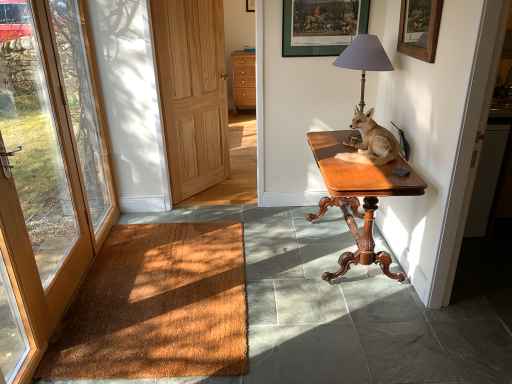
Locate an element on the screen. The width and height of the screenshot is (512, 384). brown coir mat at lower left is located at coordinates click(156, 307).

This screenshot has width=512, height=384. What do you see at coordinates (358, 196) in the screenshot?
I see `mahogany wood desk at right` at bounding box center [358, 196].

I want to click on light brown wood door at center, the 2th door when ordered from left to right, so click(192, 92).

This screenshot has width=512, height=384. What do you see at coordinates (419, 28) in the screenshot? I see `wooden framed picture at upper right, the 1th picture frame positioned from the front` at bounding box center [419, 28].

Where is `brown coir mat at lower left`? The height and width of the screenshot is (384, 512). brown coir mat at lower left is located at coordinates (156, 307).

Is wooden framed picture at upper right, which is the second picture frame in back-to-front order, directly adjacent to light brown wood drawers at center?

No, wooden framed picture at upper right, which is the second picture frame in back-to-front order, is not making contact with light brown wood drawers at center.

Which is in front, point (410, 42) or point (238, 92)?

Point (410, 42)

From the picture: Could you measure the distance between wooden framed picture at upper right, which is the second picture frame in back-to-front order, and light brown wood drawers at center?

They are 4.70 meters apart.

Considering the sizes of objects wooden framed picture at upper right, the second picture frame from the left, and light brown wood drawers at center in the image provided, who is taller, wooden framed picture at upper right, the second picture frame from the left, or light brown wood drawers at center?

Standing taller between the two is light brown wood drawers at center.

Do you think metallic gray lampshade at upper right is within green matte picture frame at upper center, the 1th picture frame in the back-to-front sequence, or outside of it?

metallic gray lampshade at upper right cannot be found inside green matte picture frame at upper center, the 1th picture frame in the back-to-front sequence.

From the image's perspective, is metallic gray lampshade at upper right located above green matte picture frame at upper center, placed as the second picture frame when sorted from front to back?

No.

Which of these two, metallic gray lampshade at upper right or green matte picture frame at upper center, the first picture frame when ordered from left to right, stands taller?

Standing taller between the two is metallic gray lampshade at upper right.

How many degrees apart are the facing directions of metallic gray lampshade at upper right and green matte picture frame at upper center, placed as the second picture frame when sorted from front to back?

The angle between the facing direction of metallic gray lampshade at upper right and the facing direction of green matte picture frame at upper center, placed as the second picture frame when sorted from front to back, is 90.7 degrees.

Is light brown fur at table right beside light brown wood door at center, which is the first door in right-to-left order?

No, light brown fur at table right is not with light brown wood door at center, which is the first door in right-to-left order.

Is light brown fur at table right taller or shorter than light brown wood door at center, which is the first door in right-to-left order?

Clearly, light brown fur at table right is shorter compared to light brown wood door at center, which is the first door in right-to-left order.

Is light brown fur at table right oriented towards light brown wood door at center, the 2th door when ordered from left to right?

No, light brown fur at table right is not oriented towards light brown wood door at center, the 2th door when ordered from left to right.

Considering the positions of points (369, 158) and (210, 128), is point (369, 158) farther from camera compared to point (210, 128)?

No, it is in front of (210, 128).

Is light brown wood door at center, which is the first door in right-to-left order, facing towards wooden framed picture at upper right, which is the second picture frame in back-to-front order?

Yes, light brown wood door at center, which is the first door in right-to-left order, is facing wooden framed picture at upper right, which is the second picture frame in back-to-front order.

Which of these two, light brown wood door at center, which is the first door in right-to-left order, or wooden framed picture at upper right, the second picture frame from the left, is wider?

With larger width is light brown wood door at center, which is the first door in right-to-left order.

Can you confirm if light brown wood door at center, which is the first door in right-to-left order, is taller than wooden framed picture at upper right, which is counted as the 1th picture frame, starting from the right?

Correct, light brown wood door at center, which is the first door in right-to-left order, is much taller as wooden framed picture at upper right, which is counted as the 1th picture frame, starting from the right.

Would you say light brown wood door at center, the 2th door when ordered from left to right, is a long distance from wooden framed picture at upper right, which is counted as the 1th picture frame, starting from the right?

Yes, light brown wood door at center, the 2th door when ordered from left to right, and wooden framed picture at upper right, which is counted as the 1th picture frame, starting from the right, are quite far apart.

From a real-world perspective, is brown wood door at left, which appears as the 2th door when viewed from the right, on light brown fur at table right?

No.

Does brown wood door at left, which appears as the 2th door when viewed from the right, have a lesser height compared to light brown fur at table right?

No, brown wood door at left, which appears as the 2th door when viewed from the right, is not shorter than light brown fur at table right.

From the image's perspective, relative to light brown fur at table right, is brown wood door at left, which appears as the 2th door when viewed from the right, above or below?

brown wood door at left, which appears as the 2th door when viewed from the right, is situated lower than light brown fur at table right in the image.

You are a GUI agent. You are given a task and a screenshot of the screen. Output one action in this format:
    pyautogui.click(x=<x>, y=<y>)
    Task: Click on the desk in front of the metallic gray lampshade at upper right
    The width and height of the screenshot is (512, 384).
    Given the screenshot: What is the action you would take?
    pyautogui.click(x=358, y=196)

From the picture: Which is more to the right, metallic gray lampshade at upper right or mahogany wood desk at right?

metallic gray lampshade at upper right.

Based on the photo, is metallic gray lampshade at upper right taller than mahogany wood desk at right?

No.

Are green matte picture frame at upper center, the first picture frame when ordered from left to right, and mahogany wood desk at right far apart?

They are positioned close to each other.

Could you tell me if green matte picture frame at upper center, placed as the second picture frame when sorted from front to back, is facing mahogany wood desk at right?

No, green matte picture frame at upper center, placed as the second picture frame when sorted from front to back, is not aimed at mahogany wood desk at right.

From a real-world perspective, between green matte picture frame at upper center, the 1th picture frame in the back-to-front sequence, and mahogany wood desk at right, who is vertically higher?

green matte picture frame at upper center, the 1th picture frame in the back-to-front sequence, is physically above.

Find the location of a particular element. This screenshot has width=512, height=384. the 2nd picture frame below when counting from the light brown wood drawers at center (from the image's perspective) is located at coordinates (419, 28).

The width and height of the screenshot is (512, 384). I want to click on lamp located in front of the green matte picture frame at upper center, marked as the 2th picture frame in a right-to-left arrangement, so click(364, 59).

Based on their spatial positions, is metallic gray lampshade at upper right or green matte picture frame at upper center, the 1th picture frame in the back-to-front sequence, closer to brown coir mat at lower left?

metallic gray lampshade at upper right.

Based on their spatial positions, is mahogany wood desk at right or light brown fur at table right further from brown coir mat at lower left?

light brown fur at table right is positioned further to the anchor brown coir mat at lower left.

Looking at the image, which one is located further to light brown wood drawers at center, wooden framed picture at upper right, the second picture frame from the left, or light brown wood door at center, the 2th door when ordered from left to right?

wooden framed picture at upper right, the second picture frame from the left.

Based on their spatial positions, is mahogany wood desk at right or light brown wood door at center, which is the first door in right-to-left order, further from green matte picture frame at upper center, the first picture frame when ordered from left to right?

Among the two, light brown wood door at center, which is the first door in right-to-left order, is located further to green matte picture frame at upper center, the first picture frame when ordered from left to right.

Considering their positions, is light brown wood drawers at center positioned closer to wooden framed picture at upper right, the second picture frame from the left, than light brown wood door at center, the 2th door when ordered from left to right?

light brown wood door at center, the 2th door when ordered from left to right, is positioned closer to the anchor wooden framed picture at upper right, the second picture frame from the left.

Considering their positions, is brown coir mat at lower left positioned closer to light brown wood drawers at center than metallic gray lampshade at upper right?

Based on the image, metallic gray lampshade at upper right appears to be nearer to light brown wood drawers at center.

From the image, which object appears to be nearer to metallic gray lampshade at upper right, light brown fur at table right or light brown wood door at center, the 2th door when ordered from left to right?

Among the two, light brown fur at table right is located nearer to metallic gray lampshade at upper right.

Which object lies nearer to the anchor point brown coir mat at lower left, green matte picture frame at upper center, placed as the second picture frame when sorted from front to back, or metallic gray lampshade at upper right?

metallic gray lampshade at upper right is positioned closer to the anchor brown coir mat at lower left.

At what (x,y) coordinates should I click in order to perform the action: click on desk between green matte picture frame at upper center, marked as the 2th picture frame in a right-to-left arrangement, and brown coir mat at lower left, in the vertical direction. Please return your answer as a coordinate pair (x, y). Looking at the image, I should click on (358, 196).

At what (x,y) coordinates should I click in order to perform the action: click on desk located between wooden framed picture at upper right, the second picture frame from the left, and light brown wood drawers at center in the depth direction. Please return your answer as a coordinate pair (x, y). Image resolution: width=512 pixels, height=384 pixels. Looking at the image, I should click on (358, 196).

You are a GUI agent. You are given a task and a screenshot of the screen. Output one action in this format:
    pyautogui.click(x=<x>, y=<y>)
    Task: Click on the door between brown coir mat at lower left and wooden framed picture at upper right, which is counted as the 1th picture frame, starting from the right, in the horizontal direction
    This screenshot has width=512, height=384.
    Given the screenshot: What is the action you would take?
    pyautogui.click(x=192, y=92)

You are a GUI agent. You are given a task and a screenshot of the screen. Output one action in this format:
    pyautogui.click(x=<x>, y=<y>)
    Task: Click on the door between green matte picture frame at upper center, marked as the 2th picture frame in a right-to-left arrangement, and light brown wood drawers at center, along the z-axis
    The width and height of the screenshot is (512, 384).
    Given the screenshot: What is the action you would take?
    pyautogui.click(x=192, y=92)